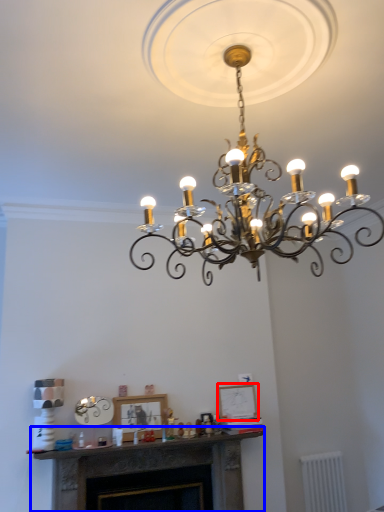
Question: Which of the following is the closest to the observer, picture frame (highlighted by a red box) or fireplace (highlighted by a blue box)?

Choices:
 (A) picture frame
 (B) fireplace

Answer: (B)